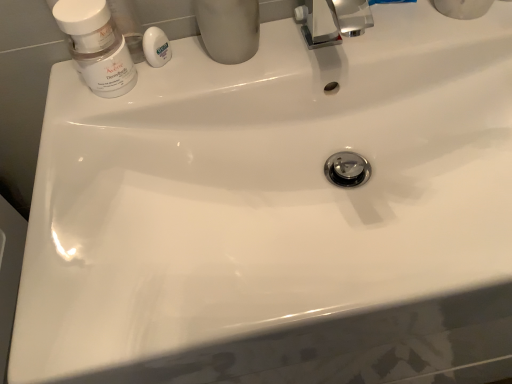
Question: Is white glossy soap at upper center further to the viewer compared to matte white jar at upper left?

Choices:
 (A) yes
 (B) no

Answer: (A)

Question: From the image's perspective, is white glossy soap at upper center over matte white jar at upper left?

Choices:
 (A) no
 (B) yes

Answer: (B)

Question: Are white glossy soap at upper center and matte white jar at upper left beside each other?

Choices:
 (A) yes
 (B) no

Answer: (A)

Question: Is white glossy soap at upper center to the left of matte white jar at upper left from the viewer's perspective?

Choices:
 (A) no
 (B) yes

Answer: (A)

Question: From a real-world perspective, does white glossy soap at upper center sit lower than matte white jar at upper left?

Choices:
 (A) yes
 (B) no

Answer: (A)

Question: From a real-world perspective, is white glossy soap at upper center physically located above or below matte white jar at upper left?

Choices:
 (A) below
 (B) above

Answer: (A)

Question: Is white glossy soap at upper center wider or thinner than matte white jar at upper left?

Choices:
 (A) thin
 (B) wide

Answer: (A)

Question: From their relative heights in the image, would you say white glossy soap at upper center is taller or shorter than matte white jar at upper left?

Choices:
 (A) tall
 (B) short

Answer: (B)

Question: Choose the correct answer: Is white glossy soap at upper center inside matte white jar at upper left or outside it?

Choices:
 (A) outside
 (B) inside

Answer: (A)

Question: Considering the relative positions of matte white jar at upper left and white glossy soap at upper center in the image provided, is matte white jar at upper left to the left or to the right of white glossy soap at upper center?

Choices:
 (A) right
 (B) left

Answer: (B)

Question: From the image's perspective, relative to white glossy soap at upper center, is matte white jar at upper left above or below?

Choices:
 (A) below
 (B) above

Answer: (A)

Question: From a real-world perspective, is matte white jar at upper left physically located above or below white glossy soap at upper center?

Choices:
 (A) above
 (B) below

Answer: (A)

Question: Is point (126, 72) closer or farther from the camera than point (162, 44)?

Choices:
 (A) closer
 (B) farther

Answer: (A)

Question: Is white glossy soap at upper center bigger or smaller than matte gray cup at upper center?

Choices:
 (A) big
 (B) small

Answer: (B)

Question: From a real-world perspective, is white glossy soap at upper center above or below matte gray cup at upper center?

Choices:
 (A) above
 (B) below

Answer: (B)